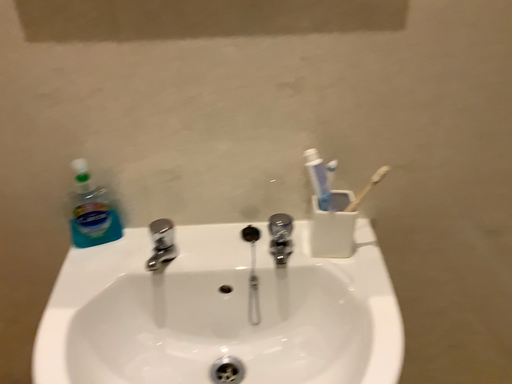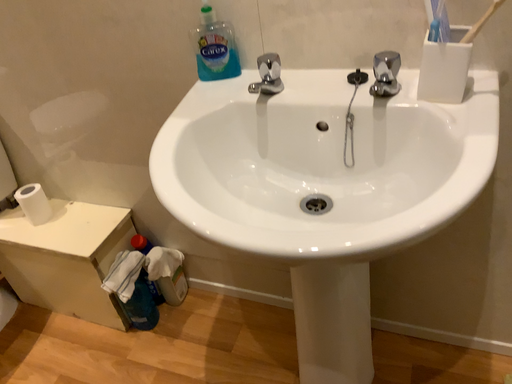
Question: Which way did the camera rotate in the video?

Choices:
 (A) rotated downward
 (B) rotated upward

Answer: (A)